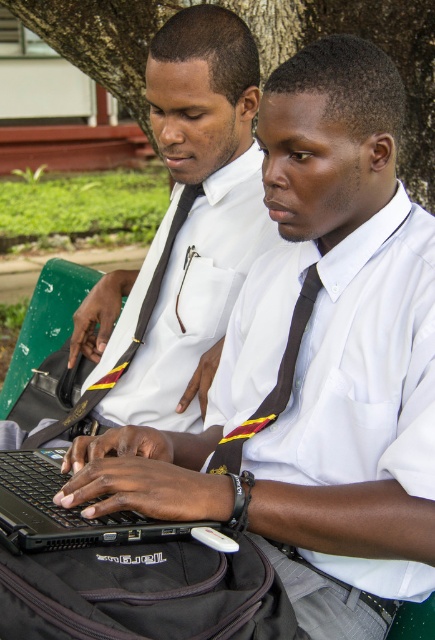
Question: Which point appears farthest from the camera in this image?

Choices:
 (A) (167, 394)
 (B) (56, 426)
 (C) (34, 509)

Answer: (B)

Question: Which object is the farthest from the black satin tie at center?

Choices:
 (A) black matte laptop at center
 (B) matte black laptop at center
 (C) green leafy tree at upper center

Answer: (C)

Question: Can you confirm if black matte laptop at center is smaller than black satin tie at center?

Choices:
 (A) no
 (B) yes

Answer: (A)

Question: Can you confirm if green leafy tree at upper center is bigger than black matte laptop at center?

Choices:
 (A) no
 (B) yes

Answer: (B)

Question: Considering the real-world distances, which object is farthest from the black satin tie at left?

Choices:
 (A) black matte laptop at center
 (B) black satin tie at center
 (C) matte black laptop at center

Answer: (A)

Question: Is black matte laptop at center in front of black satin tie at left?

Choices:
 (A) yes
 (B) no

Answer: (A)